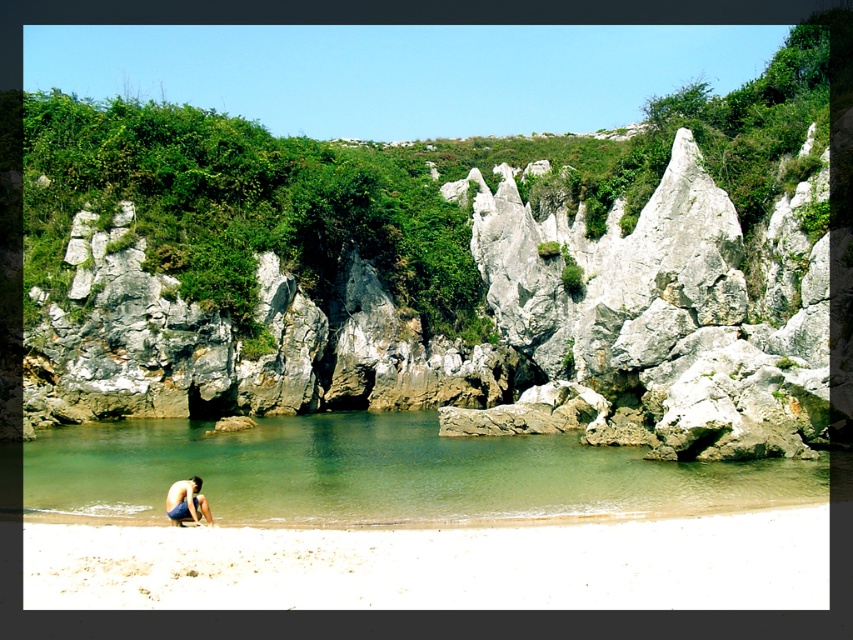
Is clear water at beach center to the left of blue denim shorts at lower left from the viewer's perspective?

No, clear water at beach center is not to the left of blue denim shorts at lower left.

Between clear water at beach center and blue denim shorts at lower left, which one has less height?

clear water at beach center is shorter.

Is point (479, 493) closer to camera compared to point (183, 493)?

No, (479, 493) is further to viewer.

The width and height of the screenshot is (853, 640). I want to click on clear water at beach center, so click(380, 472).

Which is behind, point (71, 531) or point (166, 506)?

The point (166, 506) is behind.

Does white sandy beach at lower center have a greater width compared to blue denim shorts at lower left?

Correct, the width of white sandy beach at lower center exceeds that of blue denim shorts at lower left.

This screenshot has width=853, height=640. Describe the element at coordinates (438, 564) in the screenshot. I see `white sandy beach at lower center` at that location.

Where is `white sandy beach at lower center`? The image size is (853, 640). white sandy beach at lower center is located at coordinates (438, 564).

Can you confirm if white sandy beach at lower center is taller than clear water at beach center?

Incorrect, white sandy beach at lower center's height is not larger of clear water at beach center's.

Does point (142, 531) come behind point (335, 513)?

That is False.

The image size is (853, 640). What do you see at coordinates (438, 564) in the screenshot? I see `white sandy beach at lower center` at bounding box center [438, 564].

Where is `white sandy beach at lower center`? This screenshot has height=640, width=853. white sandy beach at lower center is located at coordinates (438, 564).